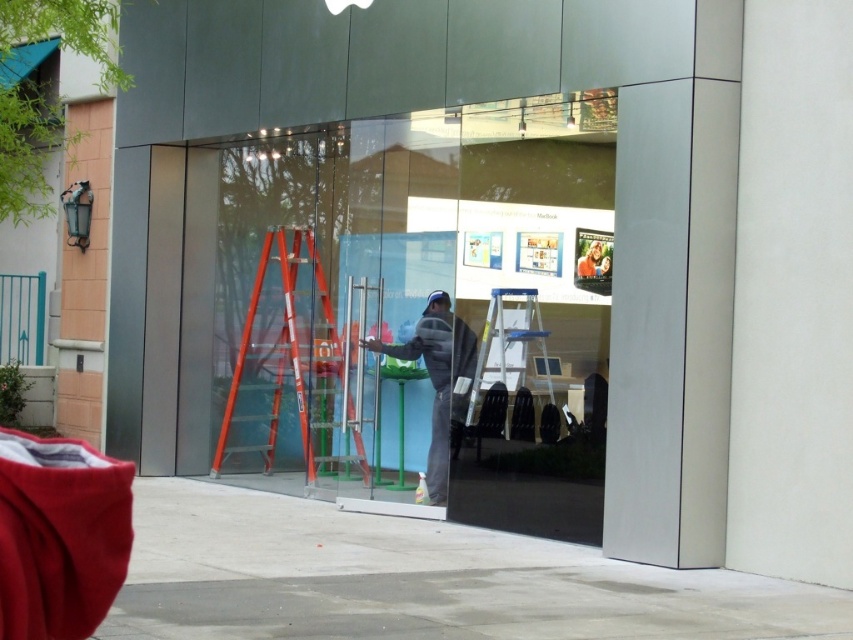
You are a delivery person trying to enter the building through the entrance. There is a point marked at coordinates (512,355) on the glass wall. What object is located at that point?

The point at coordinates (512,355) indicates a blue metallic ladder at center.

You are a delivery person trying to deliver a package to the office located above the transparent glass shop window at center. The orange fiberglass ladder at center is available. Can you use the ladder to reach the office window?

The transparent glass shop window at center has a lesser height compared to orange fiberglass ladder at center, so the ladder is taller than the window. Therefore, you can use the orange fiberglass ladder at center to reach the office window above the transparent glass shop window at center.

You are a maintenance worker who needs to reach the top of the blue metallic ladder at center to clean the glass panels. Considering the height of the ladder and the worker wearing the gray fleece jacket at center, will the ladder allow you to reach the top of the glass panels?

The blue metallic ladder at center is shorter than the gray fleece jacket at center. Since the ladder is shorter than the worker, it may not provide sufficient height to reach the top of the glass panels safely. A taller ladder would be needed for this task.